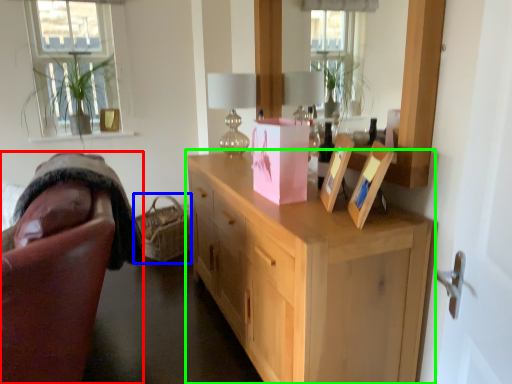
Question: Based on their relative distances, which object is farther from chair (highlighted by a red box)? Choose from basket (highlighted by a blue box) and cabinetry (highlighted by a green box).

Choices:
 (A) basket
 (B) cabinetry

Answer: (A)